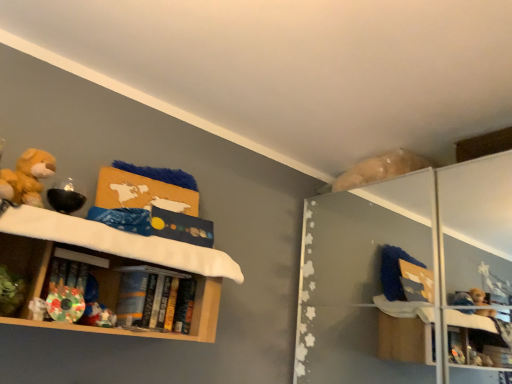
Question: Can you confirm if fluffy yellow teddy bear at left is shorter than wooden shelf at left?

Choices:
 (A) no
 (B) yes

Answer: (B)

Question: From the image's perspective, is fluffy yellow teddy bear at left over wooden shelf at left?

Choices:
 (A) no
 (B) yes

Answer: (B)

Question: From a real-world perspective, is fluffy yellow teddy bear at left on top of wooden shelf at left?

Choices:
 (A) yes
 (B) no

Answer: (A)

Question: From a real-world perspective, is fluffy yellow teddy bear at left under wooden shelf at left?

Choices:
 (A) yes
 (B) no

Answer: (B)

Question: Is the depth of fluffy yellow teddy bear at left less than that of wooden shelf at left?

Choices:
 (A) no
 (B) yes

Answer: (A)

Question: Is fluffy yellow teddy bear at left outside of wooden shelf at left?

Choices:
 (A) yes
 (B) no

Answer: (A)

Question: Is wooden shelf at left to the right of hardcover books at shelf center from the viewer's perspective?

Choices:
 (A) no
 (B) yes

Answer: (A)

Question: Is wooden shelf at left bigger than hardcover books at shelf center?

Choices:
 (A) no
 (B) yes

Answer: (B)

Question: Considering the relative positions of wooden shelf at left and hardcover books at shelf center in the image provided, is wooden shelf at left to the left of hardcover books at shelf center from the viewer's perspective?

Choices:
 (A) yes
 (B) no

Answer: (A)

Question: From a real-world perspective, is wooden shelf at left positioned over hardcover books at shelf center based on gravity?

Choices:
 (A) no
 (B) yes

Answer: (B)

Question: Is wooden shelf at left taller than hardcover books at shelf center?

Choices:
 (A) yes
 (B) no

Answer: (A)

Question: Is there a large distance between wooden shelf at left and hardcover books at shelf center?

Choices:
 (A) yes
 (B) no

Answer: (B)

Question: Is hardcover books at shelf center positioned in front of wooden shelf at left?

Choices:
 (A) no
 (B) yes

Answer: (A)